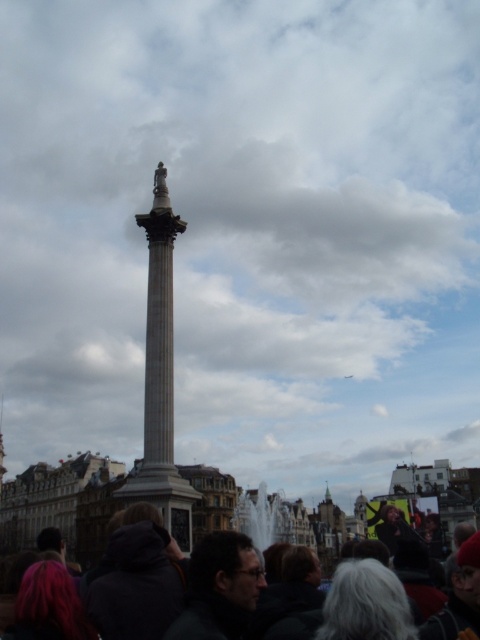
Consider the image. Between dark gray clothing at lower center and marble column at center, which one is positioned higher?

dark gray clothing at lower center is above.

Is dark gray clothing at lower center closer to camera compared to marble column at center?

Yes.

This screenshot has height=640, width=480. I want to click on dark gray clothing at lower center, so click(182, 595).